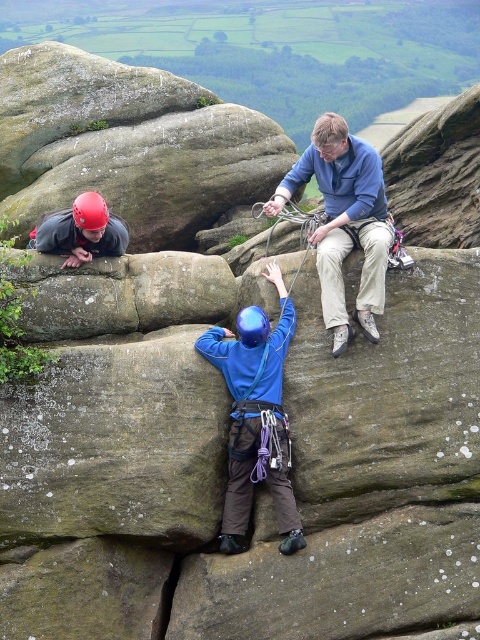
You are a climber looking at the rock formation. You see the blue fabric helmet at center and the matte red helmet at upper left. Which helmet is positioned higher on the rock formation?

The matte red helmet at upper left is positioned higher on the rock formation than the blue fabric helmet at center.

You are a climber trying to reach the blue fabric helmet at center. There is a point marked at coordinates [254,416]. Is this point located on the blue fabric helmet at center?

Yes, the point at [254,416] is on the blue fabric helmet at center according to the description.

You are a rock climber assessing the gear of two climbers in the scene. The blue fabric helmet at center and the matte red helmet at upper left are both visible. Which helmet has a larger size?

The matte red helmet at upper left has a larger size compared to the blue fabric helmet at center.